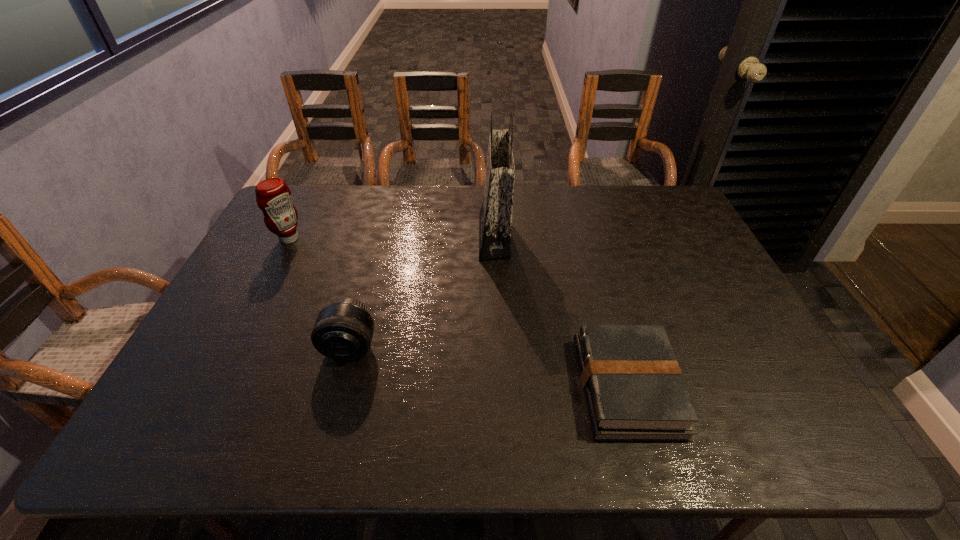
Where is `vacant space at the near edge of the desktop`? This screenshot has width=960, height=540. vacant space at the near edge of the desktop is located at coordinates (587, 431).

Locate an element on the screen. The image size is (960, 540). vacant position at the left edge of the desktop is located at coordinates (315, 224).

This screenshot has width=960, height=540. In order to click on blank space at the right edge of the desktop in this screenshot , I will do `click(688, 296)`.

Locate an element on the screen. unoccupied position between the telephoto lens and the leftmost object is located at coordinates (320, 293).

This screenshot has height=540, width=960. What are the coordinates of `free space between the third object from left to right and the rightmost object` in the screenshot? It's located at (561, 312).

Find the location of a particular element. free space that is in between the leftmost object and the shortest object is located at coordinates pyautogui.click(x=458, y=313).

Where is `blank region between the third object from left to right and the third tallest object`? blank region between the third object from left to right and the third tallest object is located at coordinates (422, 292).

At what (x,y) coordinates should I click in order to perform the action: click on vacant area between the shortest object and the shopping bag. Please return your answer as a coordinate pair (x, y). Looking at the image, I should click on (561, 312).

I want to click on free space that is in between the third object from right to left and the condiment, so click(320, 293).

Where is `free space between the shopping bag and the condiment`? Image resolution: width=960 pixels, height=540 pixels. free space between the shopping bag and the condiment is located at coordinates (392, 238).